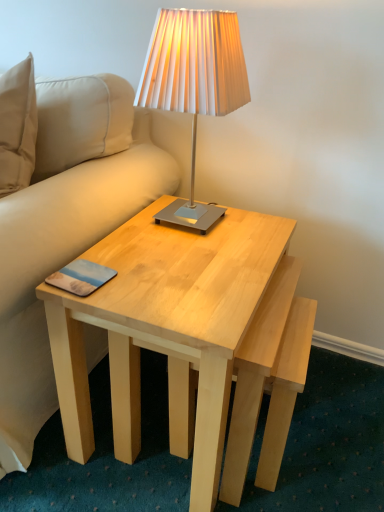
What do you see at coordinates (194, 84) in the screenshot?
I see `matte silver lamp at upper center` at bounding box center [194, 84].

Image resolution: width=384 pixels, height=512 pixels. Describe the element at coordinates (81, 277) in the screenshot. I see `matte plastic pad at lower left` at that location.

Find the location of a particular element. The width and height of the screenshot is (384, 512). matte silver lamp at upper center is located at coordinates (194, 84).

Is light wood coffee table at center next to matte silver lamp at upper center?

No.

Considering the relative sizes of light wood coffee table at center and matte silver lamp at upper center in the image provided, is light wood coffee table at center taller than matte silver lamp at upper center?

Indeed, light wood coffee table at center has a greater height compared to matte silver lamp at upper center.

Is light wood coffee table at center facing away from matte silver lamp at upper center?

light wood coffee table at center does not have its back to matte silver lamp at upper center.

Does point (69, 385) come closer to viewer compared to point (222, 64)?

No, (69, 385) is further to viewer.

Which of these two, matte silver lamp at upper center or light wood coffee table at center, is wider?

light wood coffee table at center.

Can you tell me how much matte silver lamp at upper center and light wood coffee table at center differ in facing direction?

The angle between the facing direction of matte silver lamp at upper center and the facing direction of light wood coffee table at center is 2.9e-05 degrees.

Locate an element on the screen. This screenshot has height=512, width=384. coffee table below the matte silver lamp at upper center (from the image's perspective) is located at coordinates (165, 325).

Looking at this image, which point is more distant from viewer, [245,80] or [228,248]?

The point [245,80] is farther.

Considering the relative sizes of matte plastic pad at lower left and matte silver lamp at upper center in the image provided, is matte plastic pad at lower left thinner than matte silver lamp at upper center?

Yes.

In order to click on pad on the left of matte silver lamp at upper center in this screenshot , I will do `click(81, 277)`.

Which is behind, matte plastic pad at lower left or matte silver lamp at upper center?

matte plastic pad at lower left.

From a real-world perspective, is matte plastic pad at lower left below matte silver lamp at upper center?

Yes, from a real-world perspective, matte plastic pad at lower left is below matte silver lamp at upper center.

Is light wood coffee table at center oriented away from matte plastic pad at lower left?

light wood coffee table at center is not turned away from matte plastic pad at lower left.

From the image's perspective, which is above, light wood coffee table at center or matte plastic pad at lower left?

matte plastic pad at lower left.

Considering the positions of objects light wood coffee table at center and matte plastic pad at lower left in the image provided, who is more to the left, light wood coffee table at center or matte plastic pad at lower left?

Positioned to the left is matte plastic pad at lower left.

Is light wood coffee table at center positioned far away from matte plastic pad at lower left?

No, light wood coffee table at center is not far away from matte plastic pad at lower left.

In the scene shown: From a real-world perspective, between matte silver lamp at upper center and matte plastic pad at lower left, who is vertically lower?

From a 3D spatial view, matte plastic pad at lower left is below.

Looking at their sizes, would you say matte silver lamp at upper center is wider or thinner than matte plastic pad at lower left?

Clearly, matte silver lamp at upper center has more width compared to matte plastic pad at lower left.

Is point (142, 106) closer or farther from the camera than point (85, 287)?

Clearly, point (142, 106) is more distant from the camera than point (85, 287).

From the picture: Is matte silver lamp at upper center in front of or behind matte plastic pad at lower left in the image?

matte silver lamp at upper center is positioned closer to the viewer than matte plastic pad at lower left.

Between matte plastic pad at lower left and light wood coffee table at center, which one has smaller size?

matte plastic pad at lower left.

Is matte plastic pad at lower left next to light wood coffee table at center and touching it?

No, matte plastic pad at lower left is not beside light wood coffee table at center.

From the picture: Is light wood coffee table at center inside matte plastic pad at lower left?

That's incorrect, light wood coffee table at center is not inside matte plastic pad at lower left.

Which is behind, matte plastic pad at lower left or light wood coffee table at center?

matte plastic pad at lower left.

Find the location of a particular element. The image size is (384, 512). lamp above the light wood coffee table at center (from a real-world perspective) is located at coordinates click(x=194, y=84).

Where is `lamp lying behind the light wood coffee table at center`? Image resolution: width=384 pixels, height=512 pixels. lamp lying behind the light wood coffee table at center is located at coordinates (194, 84).

From the image, which object appears to be farther from matte silver lamp at upper center, matte plastic pad at lower left or light wood coffee table at center?

matte plastic pad at lower left is further to matte silver lamp at upper center.

Considering their positions, is matte plastic pad at lower left positioned closer to light wood coffee table at center than matte silver lamp at upper center?

The object closer to light wood coffee table at center is matte plastic pad at lower left.

Based on their spatial positions, is matte silver lamp at upper center or light wood coffee table at center closer to matte plastic pad at lower left?

Based on the image, light wood coffee table at center appears to be nearer to matte plastic pad at lower left.

From the image, which object appears to be farther from matte silver lamp at upper center, light wood coffee table at center or matte plastic pad at lower left?

Among the two, matte plastic pad at lower left is located further to matte silver lamp at upper center.

Looking at the image, which one is located closer to light wood coffee table at center, matte silver lamp at upper center or matte plastic pad at lower left?

The object closer to light wood coffee table at center is matte plastic pad at lower left.

Which object lies further to the anchor point matte plastic pad at lower left, light wood coffee table at center or matte silver lamp at upper center?

Based on the image, matte silver lamp at upper center appears to be further to matte plastic pad at lower left.

Locate an element on the screen. The image size is (384, 512). pad that lies between matte silver lamp at upper center and light wood coffee table at center from top to bottom is located at coordinates (81, 277).